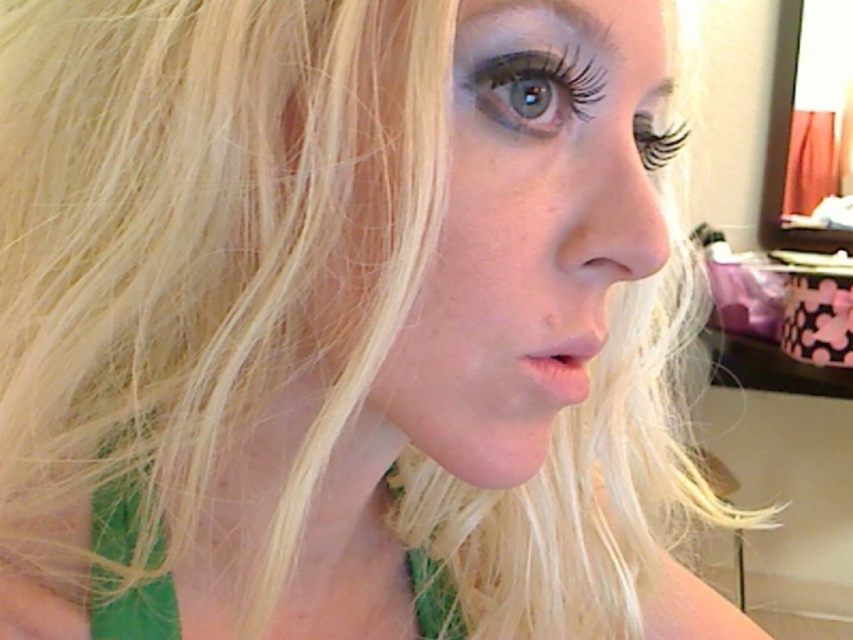
You are a makeup artist preparing to apply eyeliner. You notice the smooth skin face at center and the green matte eye at upper center. Which object is closer to you?

The smooth skin face at center is closer to you because it is in front of the green matte eye at upper center.

You are a photographer adjusting your camera focus. You notice two points in the image at coordinates point (531,56) and point (480,97). Which point is closer to the camera lens?

Point (531,56) is further to the viewer than point (480,97), meaning point (480,97) is closer to the camera lens.